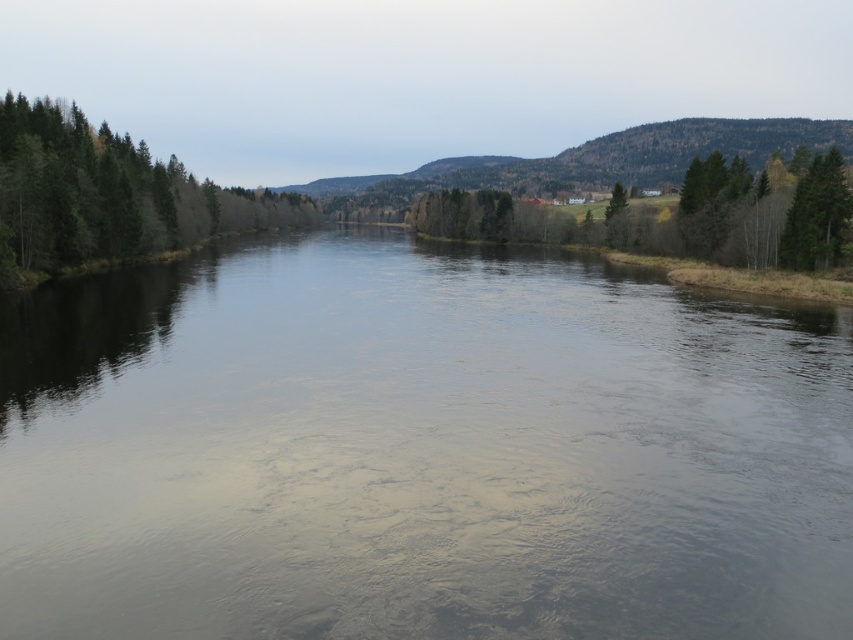
Question: From the image, what is the correct spatial relationship of smooth water at center in relation to green matte trees at left?

Choices:
 (A) above
 (B) below

Answer: (B)

Question: Among these points, which one is nearest to the camera?

Choices:
 (A) (805, 259)
 (B) (167, 177)
 (C) (166, 467)

Answer: (C)

Question: Does smooth water at center have a larger size compared to green matte tree at right?

Choices:
 (A) no
 (B) yes

Answer: (B)

Question: Which point is closer to the camera?

Choices:
 (A) (148, 163)
 (B) (808, 244)
 (C) (254, 582)

Answer: (C)

Question: Is smooth water at center above green matte tree at right?

Choices:
 (A) no
 (B) yes

Answer: (A)

Question: Which point is closer to the camera?

Choices:
 (A) smooth water at center
 (B) green matte trees at left

Answer: (A)